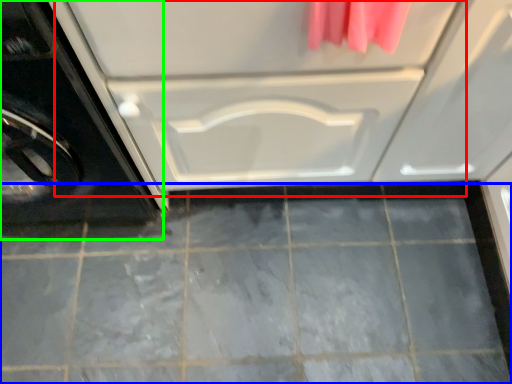
Question: Which is nearer to the drawer (highlighted by a red box)? ceramic tile (highlighted by a blue box) or washing machine (highlighted by a green box).

Choices:
 (A) ceramic tile
 (B) washing machine

Answer: (B)